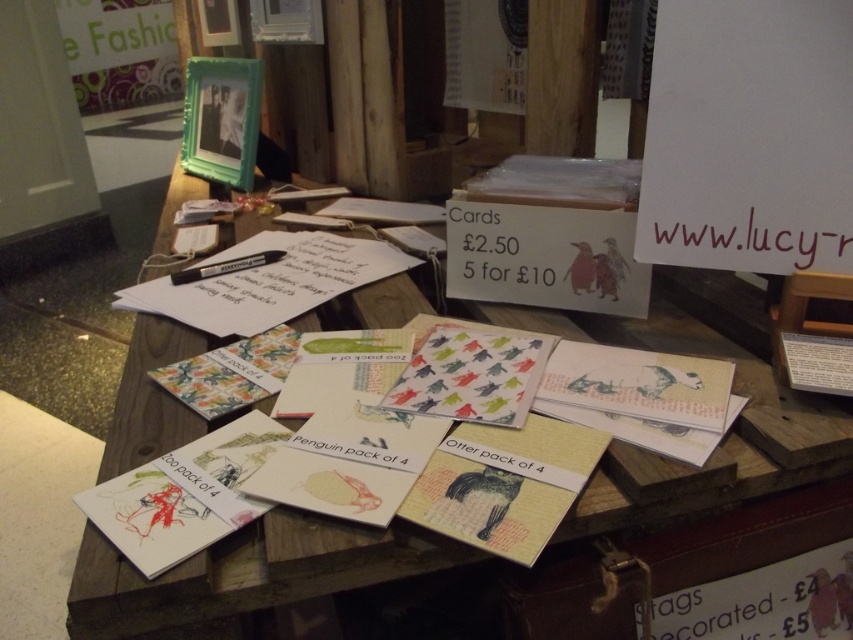
Is white paper at upper right below matte paper card at center?

Actually, white paper at upper right is above matte paper card at center.

Between white paper at upper right and matte paper card at center, which one appears on the left side from the viewer's perspective?

From the viewer's perspective, matte paper card at center appears more on the left side.

Does point (717, 67) come farther from viewer compared to point (440, 349)?

No, (717, 67) is in front of (440, 349).

The height and width of the screenshot is (640, 853). What are the coordinates of `white paper at upper right` in the screenshot? It's located at (749, 136).

Can you confirm if wooden cards at center is wider than white paper at upper right?

Correct, the width of wooden cards at center exceeds that of white paper at upper right.

Does wooden cards at center have a greater height compared to white paper at upper right?

Correct, wooden cards at center is much taller as white paper at upper right.

Between point (151, 595) and point (817, 225), which one is positioned behind?

The point (817, 225) is behind.

The height and width of the screenshot is (640, 853). What are the coordinates of `wooden cards at center` in the screenshot? It's located at (720, 442).

Between wooden cards at center and matte paper card at center, which one is positioned higher?

wooden cards at center is higher up.

Which is more to the left, wooden cards at center or matte paper card at center?

From the viewer's perspective, wooden cards at center appears more on the left side.

Who is more distant from viewer, [277,509] or [489,403]?

Positioned behind is point [489,403].

You are a GUI agent. You are given a task and a screenshot of the screen. Output one action in this format:
    pyautogui.click(x=<x>, y=<y>)
    Task: Click on the wooden cards at center
    
    Given the screenshot: What is the action you would take?
    pyautogui.click(x=720, y=442)